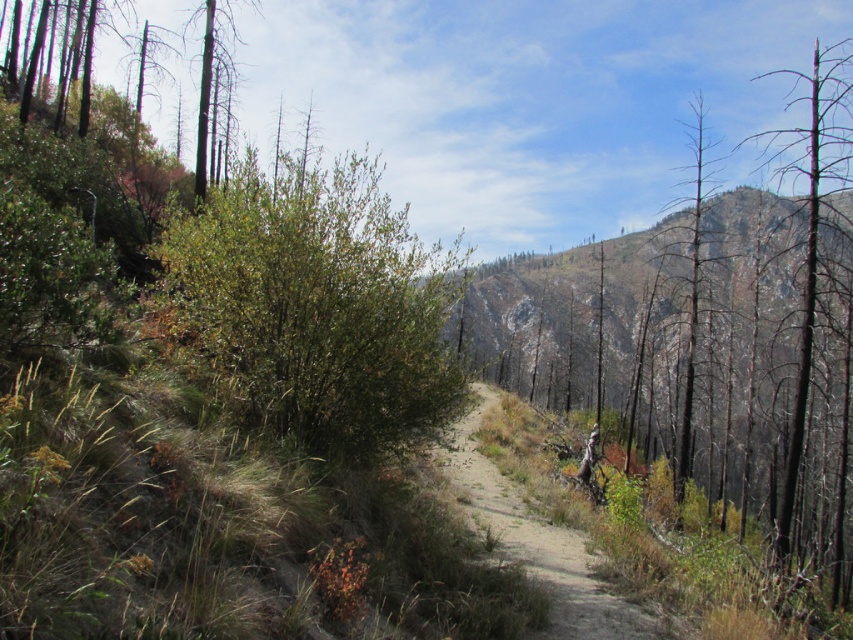
Question: From the image, what is the correct spatial relationship of dirt path at center in relation to bare wood tree at right?

Choices:
 (A) above
 (B) below

Answer: (B)

Question: Based on their relative distances, which object is farther from the dirt path at center?

Choices:
 (A) green leafy bush at center
 (B) bare wood tree at right

Answer: (B)

Question: Can you confirm if green leafy bush at center is bigger than dirt path at center?

Choices:
 (A) no
 (B) yes

Answer: (A)

Question: Can you confirm if green leafy bush at center is thinner than dirt path at center?

Choices:
 (A) no
 (B) yes

Answer: (A)

Question: Which of the following is the farthest from the observer?

Choices:
 (A) green leafy bush at center
 (B) charred wood tree at right
 (C) dirt path at center

Answer: (B)

Question: Which object is farther from the camera taking this photo?

Choices:
 (A) green leafy bush at center
 (B) charred wood tree at right
 (C) bare wood tree at right

Answer: (C)